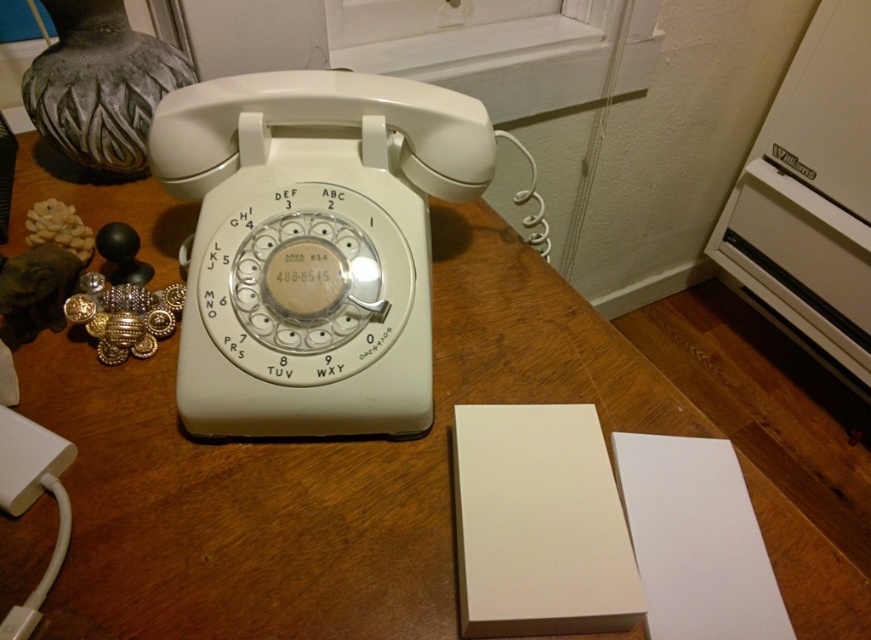
Who is positioned more to the right, white wood table at center or white plastic rotary phone at center?

white plastic rotary phone at center

Locate an element on the screen. The width and height of the screenshot is (871, 640). white wood table at center is located at coordinates (352, 477).

Where is `white wood table at center`? white wood table at center is located at coordinates (352, 477).